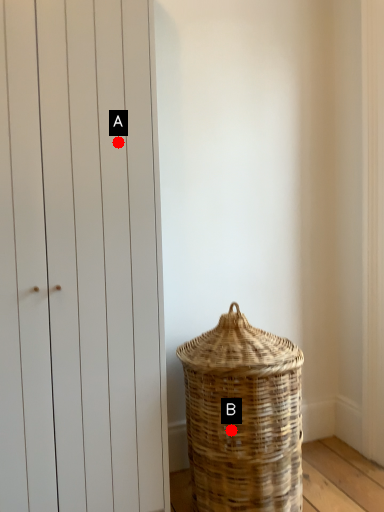
Question: Two points are circled on the image, labeled by A and B beside each circle. Among these points, which one is farthest from the camera?

Choices:
 (A) A is further
 (B) B is further

Answer: (B)